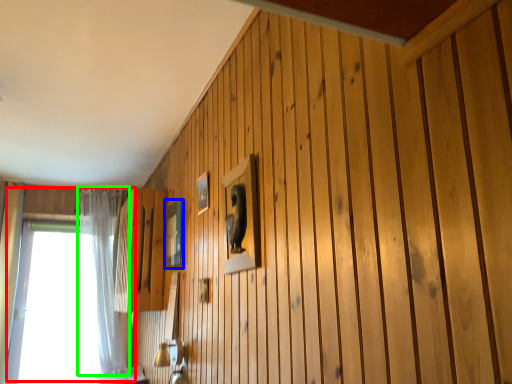
Question: Based on their relative distances, which object is farther from window (highlighted by a red box)? Choose from picture frame (highlighted by a blue box) and curtain (highlighted by a green box).

Choices:
 (A) picture frame
 (B) curtain

Answer: (A)